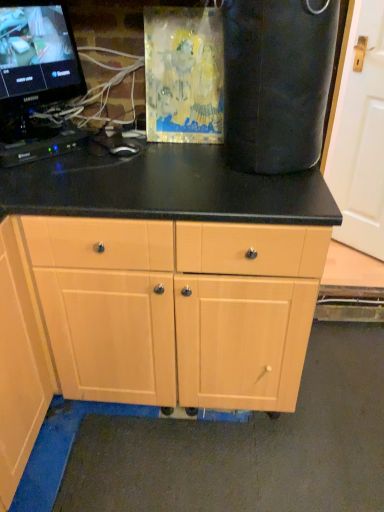
I want to click on white matte door at right, so click(360, 137).

What do you see at coordinates (42, 146) in the screenshot? This screenshot has height=512, width=384. I see `black plastic keyboard at left` at bounding box center [42, 146].

Identify the location of black glossy monitor at upper left. (35, 65).

Based on the photo, could you tell me if black glossy monitor at upper left is turned towards light wood cabinet at center?

No, black glossy monitor at upper left does not turn towards light wood cabinet at center.

Considering the positions of point (65, 8) and point (20, 366), is point (65, 8) closer or farther from the camera than point (20, 366)?

Point (65, 8).

From a real-world perspective, which object rests below the other?

From a 3D spatial view, light wood cabinet at center is below.

In the scene shown: From the image's perspective, which one is positioned higher, black glossy monitor at upper left or black plastic keyboard at left?

black glossy monitor at upper left is shown above in the image.

Does point (23, 31) appear closer or farther from the camera than point (61, 153)?

Point (23, 31) appears to be closer to the viewer than point (61, 153).

Identify the location of computer keyboard that is on the left side of black glossy monitor at upper left. The width and height of the screenshot is (384, 512). (x=42, y=146).

Looking at this image, who is taller, black glossy monitor at upper left or black plastic keyboard at left?

black glossy monitor at upper left is taller.

Is black plastic keyboard at left a part of light wood cabinet at center?

Actually, black plastic keyboard at left is outside light wood cabinet at center.

Is light wood cabinet at center far from black plastic keyboard at left?

No, light wood cabinet at center is not far from black plastic keyboard at left.

Which of these two, light wood cabinet at center or black plastic keyboard at left, stands shorter?

With less height is black plastic keyboard at left.

Is light wood cabinet at center looking in the opposite direction of black plastic keyboard at left?

No, light wood cabinet at center's orientation is not away from black plastic keyboard at left.

From the image's perspective, is light wood cabinet at center below black glossy monitor at upper left?

Correct, light wood cabinet at center appears lower than black glossy monitor at upper left in the image.

Is light wood cabinet at center oriented away from black glossy monitor at upper left?

No, light wood cabinet at center's orientation is not away from black glossy monitor at upper left.

Considering the sizes of light wood cabinet at center and black glossy monitor at upper left in the image, is light wood cabinet at center wider or thinner than black glossy monitor at upper left?

Clearly, light wood cabinet at center has more width compared to black glossy monitor at upper left.

Does white matte door at right have a lesser height compared to black plastic keyboard at left?

Incorrect, the height of white matte door at right does not fall short of that of black plastic keyboard at left.

From the image's perspective, is white matte door at right on top of black plastic keyboard at left?

Indeed, from the image's perspective, white matte door at right is shown above black plastic keyboard at left.

Can you tell me how much white matte door at right and black plastic keyboard at left differ in facing direction?

92.4 degrees separate the facing orientations of white matte door at right and black plastic keyboard at left.

At what (x,y) coordinates should I click in order to perform the action: click on computer keyboard in front of the white matte door at right. Please return your answer as a coordinate pair (x, y). Looking at the image, I should click on [42, 146].

Identify the location of computer keyboard that is above the light wood cabinet at center (from the image's perspective). Image resolution: width=384 pixels, height=512 pixels. (42, 146).

Considering the positions of objects black plastic keyboard at left and light wood cabinet at center in the image provided, who is in front, black plastic keyboard at left or light wood cabinet at center?

light wood cabinet at center is more forward.

From a real-world perspective, is black plastic keyboard at left physically located above or below light wood cabinet at center?

black plastic keyboard at left is situated higher than light wood cabinet at center in the real world.

Is black plastic keyboard at left looking in the opposite direction of light wood cabinet at center?

No, light wood cabinet at center is not at the back of black plastic keyboard at left.

From the image's perspective, would you say black plastic keyboard at left is positioned over black glossy monitor at upper left?

No, from the image's perspective, black plastic keyboard at left is not above black glossy monitor at upper left.

How much distance is there between black plastic keyboard at left and black glossy monitor at upper left?

black plastic keyboard at left and black glossy monitor at upper left are 7.70 inches apart from each other.

Is black plastic keyboard at left directly adjacent to black glossy monitor at upper left?

There is a gap between black plastic keyboard at left and black glossy monitor at upper left.

Is black plastic keyboard at left positioned with its back to black glossy monitor at upper left?

black plastic keyboard at left is not turned away from black glossy monitor at upper left.

At what (x,y) coordinates should I click in order to perform the action: click on computer monitor that is above the light wood cabinet at center (from the image's perspective). Please return your answer as a coordinate pair (x, y). This screenshot has width=384, height=512. Looking at the image, I should click on (35, 65).

Locate an element on the screen. computer monitor that appears above the black plastic keyboard at left (from a real-world perspective) is located at coordinates (35, 65).

Which object lies nearer to the anchor point black glossy monitor at upper left, black plastic keyboard at left or light wood cabinet at center?

black plastic keyboard at left.

When comparing their distances from black plastic keyboard at left, does light wood cabinet at center or white matte door at right seem closer?

light wood cabinet at center is positioned closer to the anchor black plastic keyboard at left.

Looking at this image, when comparing their distances from black glossy monitor at upper left, does light wood cabinet at center or black plastic keyboard at left seem further?

The object further to black glossy monitor at upper left is light wood cabinet at center.

Based on the photo, when comparing their distances from white matte door at right, does black plastic keyboard at left or light wood cabinet at center seem further?

light wood cabinet at center is positioned further to the anchor white matte door at right.

From the picture: From the image, which object appears to be farther from black plastic keyboard at left, white matte door at right or black glossy monitor at upper left?

Based on the image, white matte door at right appears to be further to black plastic keyboard at left.

Based on their spatial positions, is black glossy monitor at upper left or white matte door at right further from light wood cabinet at center?

Based on the image, white matte door at right appears to be further to light wood cabinet at center.

From the image, which object appears to be farther from black glossy monitor at upper left, white matte door at right or light wood cabinet at center?

Based on the image, white matte door at right appears to be further to black glossy monitor at upper left.

Based on their spatial positions, is black glossy monitor at upper left or black plastic keyboard at left closer to light wood cabinet at center?

black plastic keyboard at left is closer to light wood cabinet at center.

Where is `cabinet situated between black glossy monitor at upper left and white matte door at right from left to right`? The height and width of the screenshot is (512, 384). cabinet situated between black glossy monitor at upper left and white matte door at right from left to right is located at coordinates (131, 314).

You are a GUI agent. You are given a task and a screenshot of the screen. Output one action in this format:
    pyautogui.click(x=<x>, y=<y>)
    Task: Click on the computer monitor between black plastic keyboard at left and white matte door at right in the horizontal direction
    
    Given the screenshot: What is the action you would take?
    pyautogui.click(x=35, y=65)

Where is `cabinet between black plastic keyboard at left and white matte door at right in the horizontal direction`? Image resolution: width=384 pixels, height=512 pixels. cabinet between black plastic keyboard at left and white matte door at right in the horizontal direction is located at coordinates (131, 314).

Find the location of a particular element. computer keyboard between black glossy monitor at upper left and light wood cabinet at center from top to bottom is located at coordinates (42, 146).